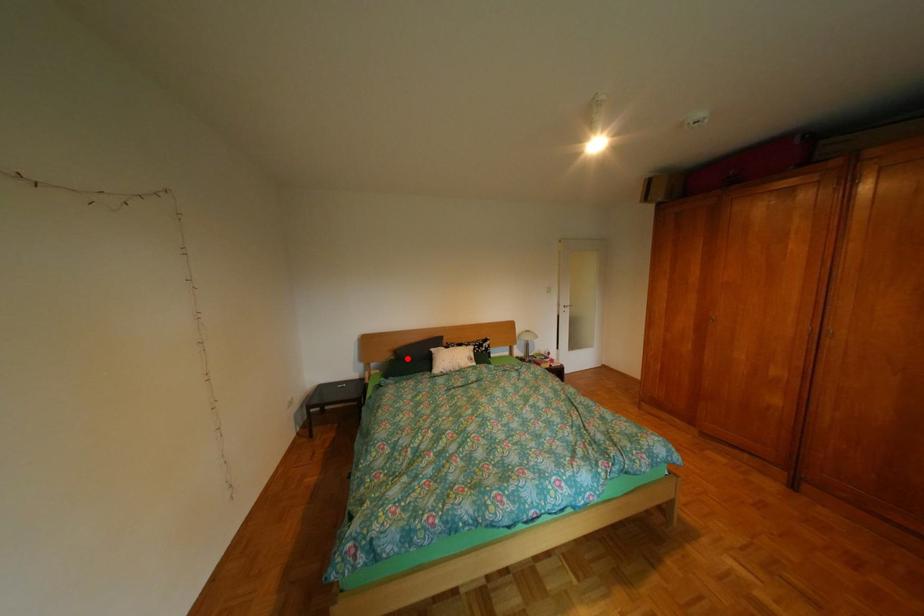
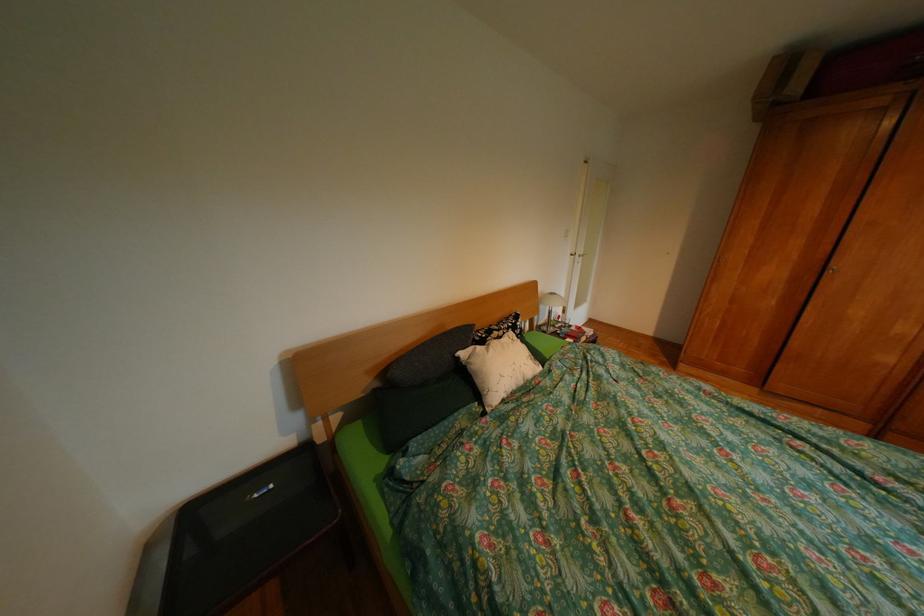
Question: I am providing you with two images of the same scene from different viewpoints. A red point is shown in image1. For the corresponding object point in image2, is it positioned nearer or farther from the camera?

Choices:
 (A) Nearer
 (B) Farther

Answer: (B)